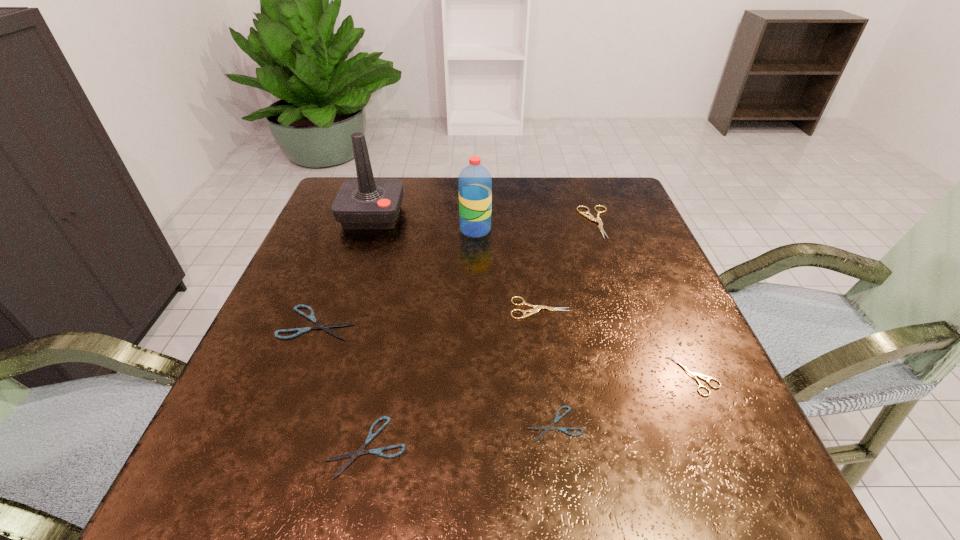
Identify the location of vacant position located on the back of the rightmost shears. (646, 264).

I want to click on vacant area situated 0.180m on the right of the second black shears from right to left, so pyautogui.click(x=523, y=447).

You are a GUI agent. You are given a task and a screenshot of the screen. Output one action in this format:
    pyautogui.click(x=<x>, y=<y>)
    Task: Click on the vacant space located 0.310m on the back of the smallest black shears
    This screenshot has width=960, height=540.
    Given the screenshot: What is the action you would take?
    pyautogui.click(x=534, y=282)

You are a GUI agent. You are given a task and a screenshot of the screen. Output one action in this format:
    pyautogui.click(x=<x>, y=<y>)
    Task: Click on the joystick that is positioned at the far edge
    This screenshot has height=540, width=960.
    Given the screenshot: What is the action you would take?
    pyautogui.click(x=365, y=203)

Locate an element on the screen. water bottle located in the far edge section of the desktop is located at coordinates (475, 182).

This screenshot has height=540, width=960. What are the coordinates of `shears positioned at the far edge` in the screenshot? It's located at (590, 217).

Find the location of `object that is at the near edge`. object that is at the near edge is located at coordinates (360, 451).

Identify the location of joystick located in the left edge section of the desktop. (365, 203).

Locate an element on the screen. The image size is (960, 540). shears that is positioned at the left edge is located at coordinates (311, 317).

At what (x,y) coordinates should I click in order to perform the action: click on object that is positioned at the far left corner. Please return your answer as a coordinate pair (x, y). Looking at the image, I should click on (365, 203).